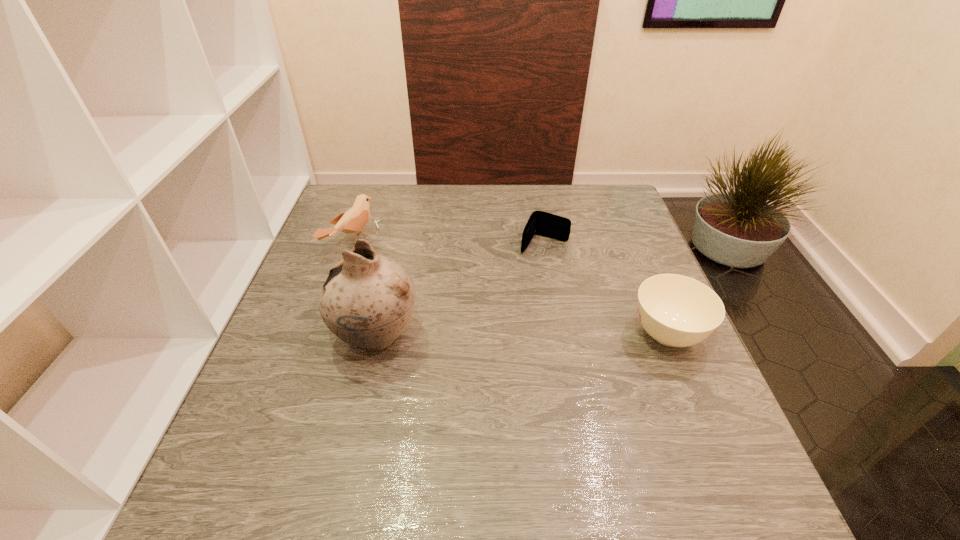
At what (x,y) coordinates should I click in order to perform the action: click on vacant area that lies between the bird and the sugar bowl. Please return your answer as a coordinate pair (x, y). The height and width of the screenshot is (540, 960). Looking at the image, I should click on (510, 288).

Locate an element on the screen. free spot between the second object from right to left and the rightmost object is located at coordinates pyautogui.click(x=606, y=289).

At what (x,y) coordinates should I click in order to perform the action: click on free spot between the sugar bowl and the bird. Please return your answer as a coordinate pair (x, y). Looking at the image, I should click on (510, 288).

This screenshot has width=960, height=540. Find the location of `empty space between the bird and the rightmost object`. empty space between the bird and the rightmost object is located at coordinates (510, 288).

Identify the location of free space between the rightmost object and the wallet. (606, 289).

At what (x,y) coordinates should I click in order to perform the action: click on free spot between the shortest object and the sugar bowl. Please return your answer as a coordinate pair (x, y). Looking at the image, I should click on (606, 289).

Where is `the third closest object relative to the shortest object`? The width and height of the screenshot is (960, 540). the third closest object relative to the shortest object is located at coordinates (352, 221).

Find the location of a particular element. This screenshot has height=540, width=960. the second closest object to the shortest object is located at coordinates (367, 300).

This screenshot has height=540, width=960. I want to click on free space in the image that satisfies the following two spatial constraints: 1. on the front side of the bird; 2. from the spout of the pottery, so click(319, 335).

Identify the location of blank area in the image that satisfies the following two spatial constraints: 1. on the front side of the wallet; 2. on the right side of the bird. pos(350,245).